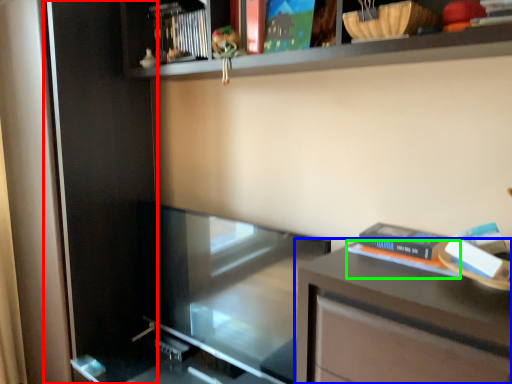
Question: Estimate the real-world distances between objects in this image. Which object is closer to screen door (highlighted by a red box), table (highlighted by a blue box) or paperback book (highlighted by a green box)?

Choices:
 (A) table
 (B) paperback book

Answer: (B)